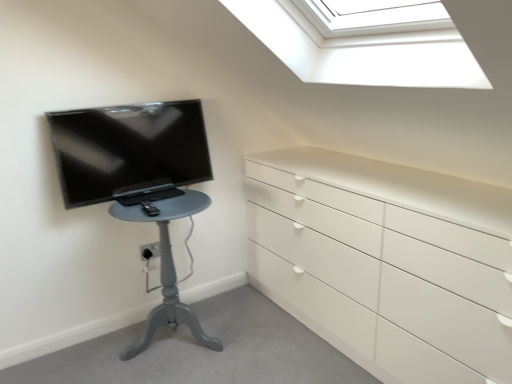
Question: From a real-world perspective, is matte gray table at left above or below matte black tv at left?

Choices:
 (A) above
 (B) below

Answer: (B)

Question: Is point (x=200, y=201) positioned closer to the camera than point (x=185, y=105)?

Choices:
 (A) farther
 (B) closer

Answer: (B)

Question: From the image's perspective, is matte gray table at left above or below matte black tv at left?

Choices:
 (A) below
 (B) above

Answer: (A)

Question: In terms of height, does matte black tv at left look taller or shorter compared to matte gray table at left?

Choices:
 (A) tall
 (B) short

Answer: (B)

Question: Considering the relative positions of matte black tv at left and matte gray table at left in the image provided, is matte black tv at left to the left or to the right of matte gray table at left?

Choices:
 (A) right
 (B) left

Answer: (B)

Question: From a real-world perspective, relative to matte gray table at left, is matte black tv at left vertically above or below?

Choices:
 (A) above
 (B) below

Answer: (A)

Question: From the image's perspective, is matte black tv at left located above or below matte gray table at left?

Choices:
 (A) above
 (B) below

Answer: (A)